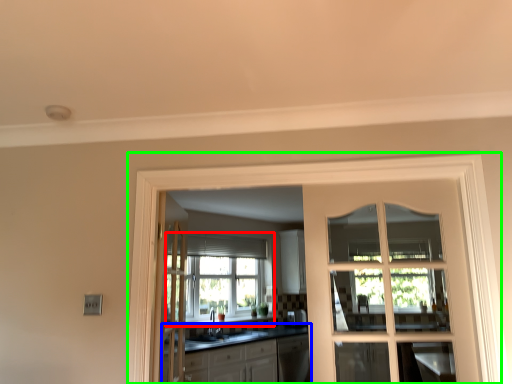
Question: Based on their relative distances, which object is nearer to window (highlighted by a red box)? Choose from cabinetry (highlighted by a blue box) and window frame (highlighted by a green box).

Choices:
 (A) cabinetry
 (B) window frame

Answer: (A)